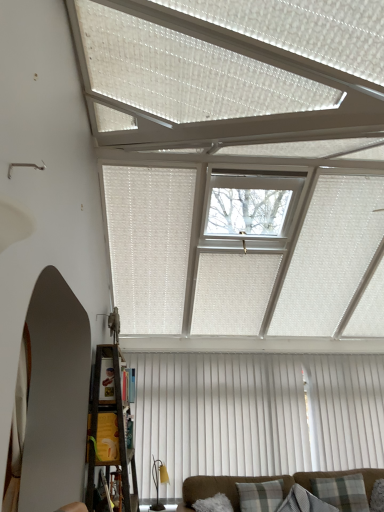
Question: Would you say plaid fabric pillow at lower right, which is the 3th pillow in left-to-right order, is to the left or to the right of clear glass window at center in the picture?

Choices:
 (A) left
 (B) right

Answer: (B)

Question: Considering their positions, is plaid fabric pillow at lower right, the 1th pillow viewed from the right, located in front of or behind clear glass window at center?

Choices:
 (A) behind
 (B) front

Answer: (A)

Question: Estimate the real-world distances between objects in this image. Which object is closer to the white vertical blinds at center?

Choices:
 (A) plaid fabric pillow at lower right, the 1th pillow viewed from the right
 (B) brown fabric couch at lower center
 (C) plaid fabric pillow at lower center, which appears as the 1th pillow when viewed from the left
 (D) plaid fabric pillow at center, the 2th pillow when ordered from right to left
 (E) clear glass window at center

Answer: (B)

Question: Which object is the closest to the clear glass window at center?

Choices:
 (A) wooden bookshelf at lower left
 (B) brown fabric couch at lower center
 (C) plaid fabric pillow at center, the 2th pillow when ordered from right to left
 (D) plaid fabric pillow at lower center, which appears as the 1th pillow when viewed from the left
 (E) white vertical blinds at center

Answer: (A)